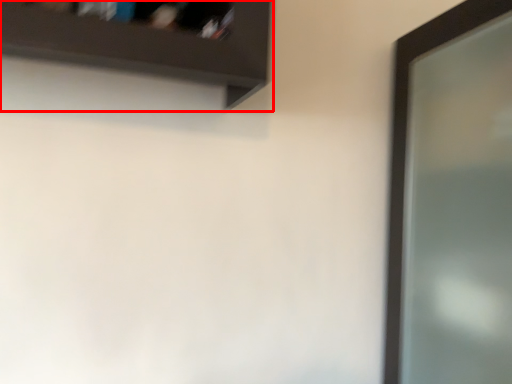
Question: From the image's perspective, what is the correct spatial positioning of shelf (annotated by the red box) in reference to screen door?

Choices:
 (A) below
 (B) above

Answer: (B)